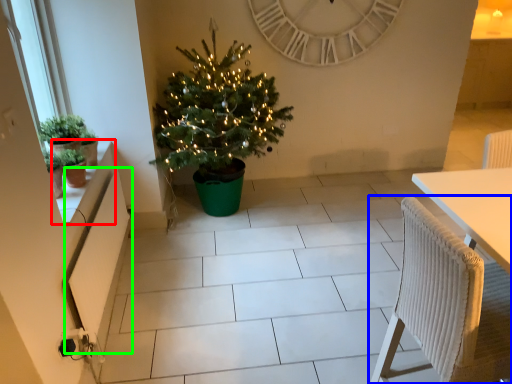
Question: Which object is the farthest from window sill (highlighted by a red box)? Choose among these: chair (highlighted by a blue box) or radiator (highlighted by a green box).

Choices:
 (A) chair
 (B) radiator

Answer: (A)